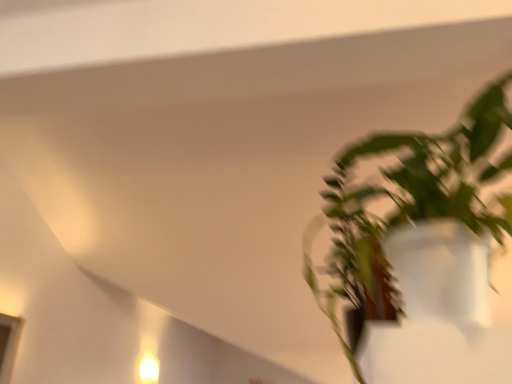
Locate an element on the screen. Image resolution: width=512 pixels, height=384 pixels. white glossy light fixture at lower left is located at coordinates (148, 368).

This screenshot has width=512, height=384. What do you see at coordinates (148, 368) in the screenshot?
I see `white glossy light fixture at lower left` at bounding box center [148, 368].

In order to face white glossy light fixture at lower left, should I rotate leftwards or rightwards?

Turn left approximately 13.998 degrees to face it.

What is the approximate width of white glossy light fixture at lower left?

white glossy light fixture at lower left is 4.07 inches in width.

The image size is (512, 384). I want to click on green matte plant at right, so click(x=422, y=250).

This screenshot has width=512, height=384. What do you see at coordinates (422, 250) in the screenshot? I see `green matte plant at right` at bounding box center [422, 250].

Locate an element on the screen. Image resolution: width=512 pixels, height=384 pixels. white glossy light fixture at lower left is located at coordinates (148, 368).

Is green matte plant at right to the left or to the right of white glossy light fixture at lower left in the image?

Based on their positions, green matte plant at right is located to the right of white glossy light fixture at lower left.

Is green matte plant at right positioned in front of white glossy light fixture at lower left?

Yes, green matte plant at right is in front of white glossy light fixture at lower left.

Between point (372, 195) and point (143, 359), which one is positioned behind?

The point (143, 359) is more distant.

From the image's perspective, is green matte plant at right on white glossy light fixture at lower left?

Yes, from the image's perspective, green matte plant at right is above white glossy light fixture at lower left.

From a real-world perspective, is green matte plant at right on top of white glossy light fixture at lower left?

Yes, from a real-world perspective, green matte plant at right is above white glossy light fixture at lower left.

Between green matte plant at right and white glossy light fixture at lower left, which one has larger width?

green matte plant at right.

Is green matte plant at right taller than white glossy light fixture at lower left?

Yes.

Who is bigger, green matte plant at right or white glossy light fixture at lower left?

With larger size is green matte plant at right.

Is green matte plant at right inside the boundaries of white glossy light fixture at lower left, or outside?

green matte plant at right exists outside the volume of white glossy light fixture at lower left.

Would you say green matte plant at right is a long distance from white glossy light fixture at lower left?

Yes, green matte plant at right is far from white glossy light fixture at lower left.

Is green matte plant at right aimed at white glossy light fixture at lower left?

No, green matte plant at right does not turn towards white glossy light fixture at lower left.

Can you tell me how much green matte plant at right and white glossy light fixture at lower left differ in facing direction?

They differ by 94 degrees in their facing directions.

This screenshot has width=512, height=384. Identify the location of houseplant located in front of the white glossy light fixture at lower left. (422, 250).

Which object is positioned more to the right, white glossy light fixture at lower left or green matte plant at right?

Positioned to the right is green matte plant at right.

Which object is closer to the camera taking this photo, white glossy light fixture at lower left or green matte plant at right?

green matte plant at right is in front.

Does point (153, 363) lie behind point (448, 245)?

Yes, it is behind point (448, 245).

From the image's perspective, which one is positioned lower, white glossy light fixture at lower left or green matte plant at right?

white glossy light fixture at lower left appears lower in the image.

From a real-world perspective, which is physically below, white glossy light fixture at lower left or green matte plant at right?

white glossy light fixture at lower left is physically lower.

Which object is wider, white glossy light fixture at lower left or green matte plant at right?

With larger width is green matte plant at right.

Between white glossy light fixture at lower left and green matte plant at right, which one has more height?

With more height is green matte plant at right.

In terms of size, does white glossy light fixture at lower left appear bigger or smaller than green matte plant at right?

white glossy light fixture at lower left is smaller than green matte plant at right.

From the picture: Is white glossy light fixture at lower left located outside green matte plant at right?

white glossy light fixture at lower left is positioned outside green matte plant at right.

Would you say white glossy light fixture at lower left is a long distance from green matte plant at right?

Absolutely, white glossy light fixture at lower left is distant from green matte plant at right.

Is white glossy light fixture at lower left facing towards green matte plant at right?

No.

Where is `light fixture on the left of green matte plant at right`? The height and width of the screenshot is (384, 512). light fixture on the left of green matte plant at right is located at coordinates (148, 368).

Find the location of a particular element. houseplant on the right side of white glossy light fixture at lower left is located at coordinates (422, 250).

At what (x,y) coordinates should I click in order to perform the action: click on light fixture on the left of green matte plant at right. Please return your answer as a coordinate pair (x, y). The height and width of the screenshot is (384, 512). Looking at the image, I should click on (148, 368).